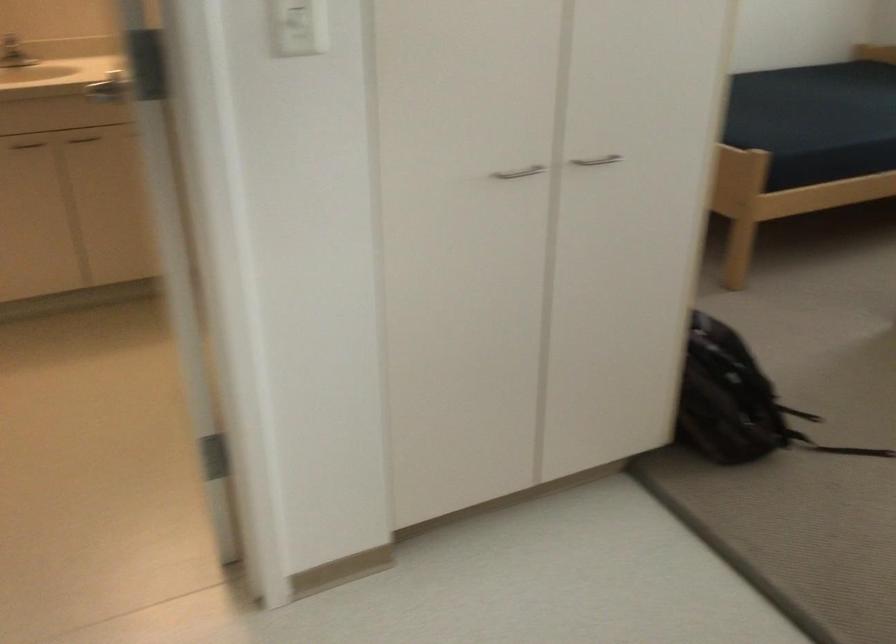
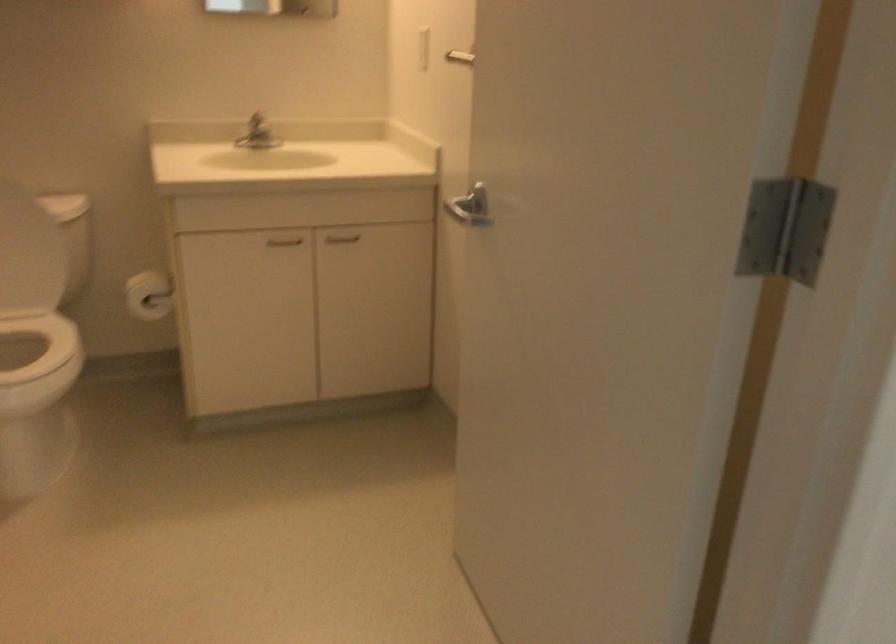
Question: The first image is from the beginning of the video and the second image is from the end. How did the camera likely rotate when shooting the video?

Choices:
 (A) Left
 (B) Right
 (C) Up
 (D) Down

Answer: (C)